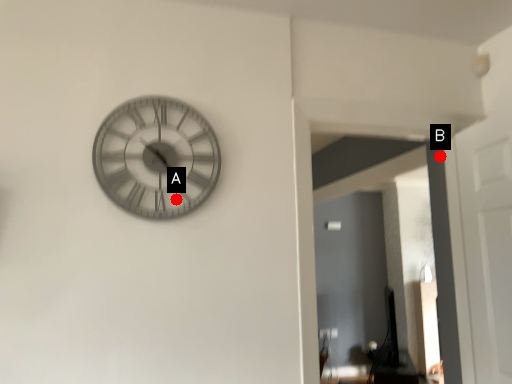
Question: Two points are circled on the image, labeled by A and B beside each circle. Which point is farther from the camera taking this photo?

Choices:
 (A) A is further
 (B) B is further

Answer: (B)